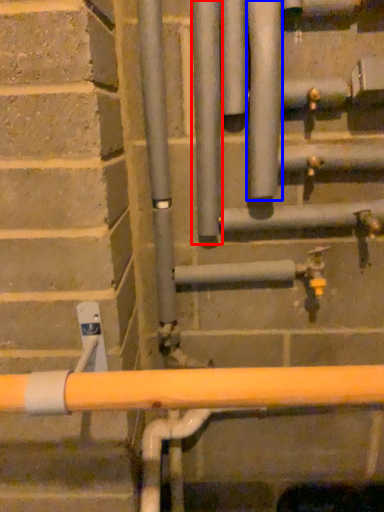
Question: Among these objects, which one is nearest to the camera, pipe (highlighted by a red box) or pipe (highlighted by a blue box)?

Choices:
 (A) pipe
 (B) pipe

Answer: (B)